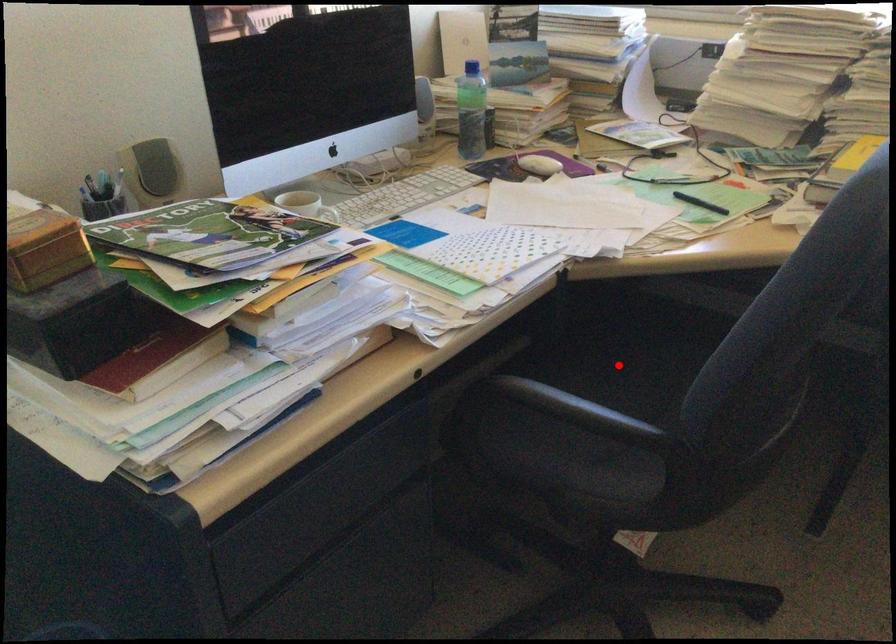
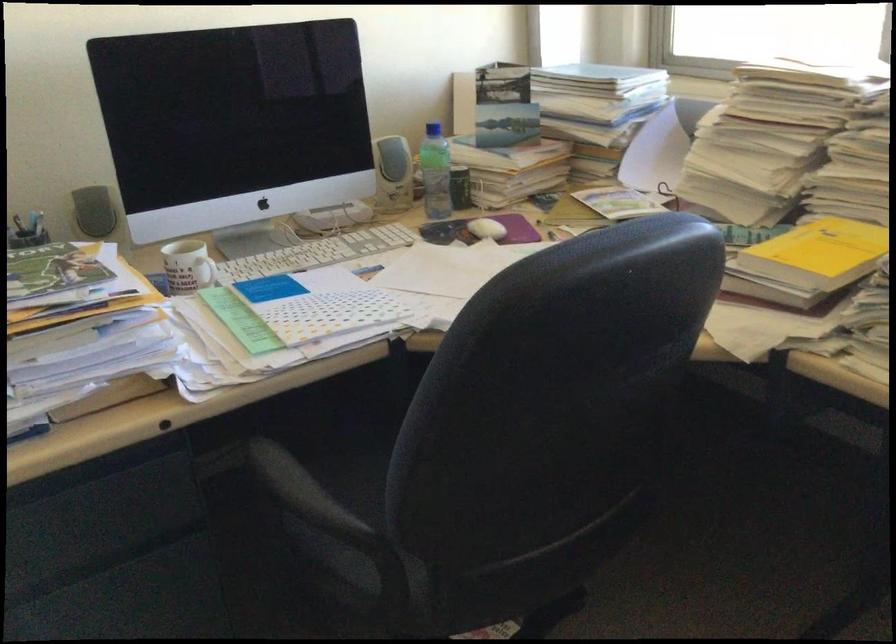
Question: I am providing you with two images of the same scene from different viewpoints. A red point is marked on the first image. Is the red point's position out of view in image 2?

Choices:
 (A) Yes
 (B) No

Answer: (A)